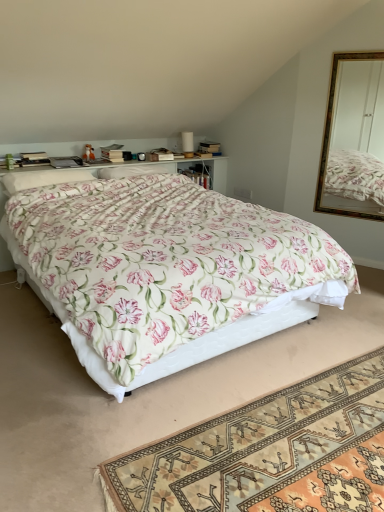
Where is `free spot below floral fabric rug at lower center (from a real-world perspective)`? Image resolution: width=384 pixels, height=512 pixels. free spot below floral fabric rug at lower center (from a real-world perspective) is located at coordinates (289, 441).